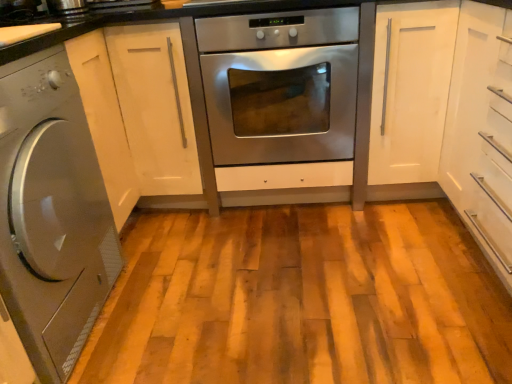
Question: Considering the relative sizes of satin silver washing machine at left and white matte cabinet at right, which is counted as the 2th cabinetry, starting from the left, in the image provided, is satin silver washing machine at left shorter than white matte cabinet at right, which is counted as the 2th cabinetry, starting from the left,?

Choices:
 (A) yes
 (B) no

Answer: (A)

Question: Does satin silver washing machine at left have a smaller size compared to white matte cabinet at right, the 1th cabinetry from the right?

Choices:
 (A) yes
 (B) no

Answer: (B)

Question: From a real-world perspective, is satin silver washing machine at left positioned under white matte cabinet at right, which is counted as the 2th cabinetry, starting from the left, based on gravity?

Choices:
 (A) no
 (B) yes

Answer: (A)

Question: Does satin silver washing machine at left appear on the right side of white matte cabinet at right, the 1th cabinetry from the right?

Choices:
 (A) no
 (B) yes

Answer: (A)

Question: Does satin silver washing machine at left have a greater width compared to white matte cabinet at right, the 1th cabinetry from the right?

Choices:
 (A) yes
 (B) no

Answer: (A)

Question: From a real-world perspective, is satin silver washing machine at left over white matte cabinet at right, which is counted as the 2th cabinetry, starting from the left?

Choices:
 (A) no
 (B) yes

Answer: (B)

Question: Can you confirm if white matte cabinet at right, which is counted as the 2th cabinetry, starting from the left, is thinner than white glossy cabinet at center, which is counted as the first cabinetry, starting from the left?

Choices:
 (A) yes
 (B) no

Answer: (A)

Question: Is white matte cabinet at right, which is counted as the 2th cabinetry, starting from the left, to the right of white glossy cabinet at center, which is counted as the first cabinetry, starting from the left, from the viewer's perspective?

Choices:
 (A) yes
 (B) no

Answer: (A)

Question: Does white matte cabinet at right, the 1th cabinetry from the right, come behind white glossy cabinet at center, arranged as the second cabinetry when viewed from the right?

Choices:
 (A) yes
 (B) no

Answer: (B)

Question: Does white matte cabinet at right, which is counted as the 2th cabinetry, starting from the left, come in front of white glossy cabinet at center, arranged as the second cabinetry when viewed from the right?

Choices:
 (A) no
 (B) yes

Answer: (B)

Question: Is white matte cabinet at right, the 1th cabinetry from the right, with white glossy cabinet at center, arranged as the second cabinetry when viewed from the right?

Choices:
 (A) yes
 (B) no

Answer: (B)

Question: Would you consider white matte cabinet at right, the 1th cabinetry from the right, to be distant from white glossy cabinet at center, which is counted as the first cabinetry, starting from the left?

Choices:
 (A) yes
 (B) no

Answer: (B)

Question: From a real-world perspective, is stainless steel oven at center located higher than white matte cabinet at right, the 1th cabinetry from the right?

Choices:
 (A) no
 (B) yes

Answer: (A)